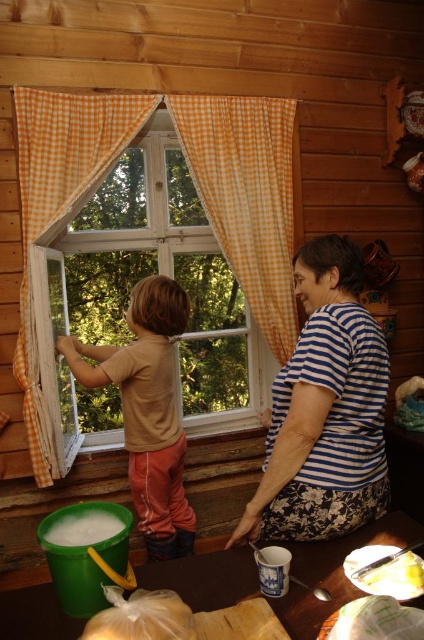
Is point (155, 138) in front of point (181, 131)?

No, (155, 138) is behind (181, 131).

Which of these two, clear glass window at center or orange checkered curtain at center, stands shorter?

Standing shorter between the two is orange checkered curtain at center.

What do you see at coordinates (128, 300) in the screenshot?
I see `clear glass window at center` at bounding box center [128, 300].

The height and width of the screenshot is (640, 424). I want to click on clear glass window at center, so click(x=128, y=300).

Find the location of a particular element. This screenshot has height=640, width=424. clear glass window at center is located at coordinates (128, 300).

Between clear glass window at center and brown cotton shirt at left, which one appears on the right side from the viewer's perspective?

brown cotton shirt at left is more to the right.

Does point (35, 282) lie in front of point (162, 486)?

Yes, it is in front of point (162, 486).

Where is `clear glass window at center`? clear glass window at center is located at coordinates (128, 300).

Who is shorter, clear glass window at center or blue striped shirt at center?

Standing shorter between the two is blue striped shirt at center.

Does clear glass window at center have a larger size compared to blue striped shirt at center?

Correct, clear glass window at center is larger in size than blue striped shirt at center.

At what (x,y) coordinates should I click in order to perform the action: click on clear glass window at center. Please return your answer as a coordinate pair (x, y). The image size is (424, 640). Looking at the image, I should click on (128, 300).